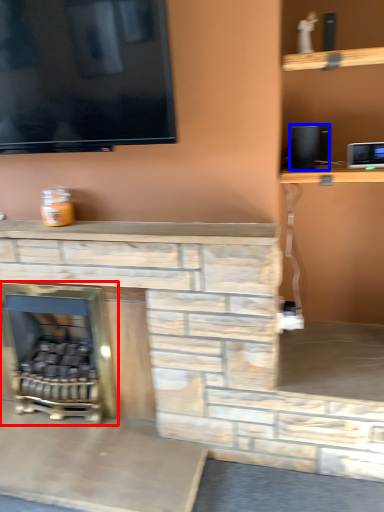
Question: Which of the following is the closest to the observer, fireplace (highlighted by a red box) or speaker (highlighted by a blue box)?

Choices:
 (A) fireplace
 (B) speaker

Answer: (B)